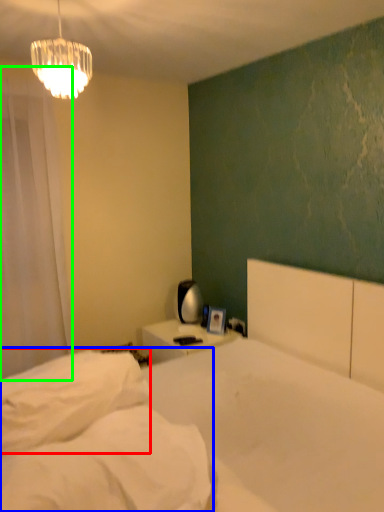
Question: Which object is positioned farthest from pillow (highlighted by a red box)? Select from mattress (highlighted by a blue box) and curtain (highlighted by a green box).

Choices:
 (A) mattress
 (B) curtain

Answer: (B)